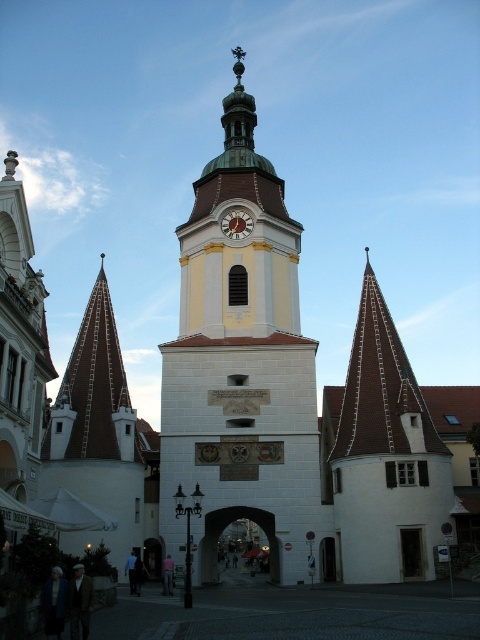
You are a maintenance worker needing to reach the gold metallic clock at center for repairs. The yellow stone clock tower at center has a ladder that can extend up to 20 meters. Will the ladder be sufficient to reach the clock?

The yellow stone clock tower at center is 20.77 meters from the gold metallic clock at center. Since the ladder can only extend up to 20 meters, it will not be sufficient to reach the gold metallic clock at center.

What are the coordinates of the yellow stone clock tower at center?

The yellow stone clock tower at center is located at coordinates point [240,365].